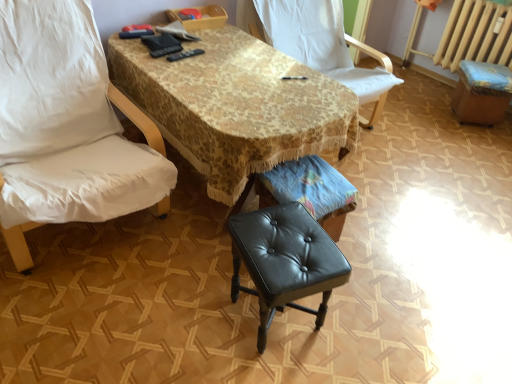
Where is `free space that is in between black leather stool at center and white fabric chair at left, which appears as the first chair when viewed from the left`? free space that is in between black leather stool at center and white fabric chair at left, which appears as the first chair when viewed from the left is located at coordinates (164, 296).